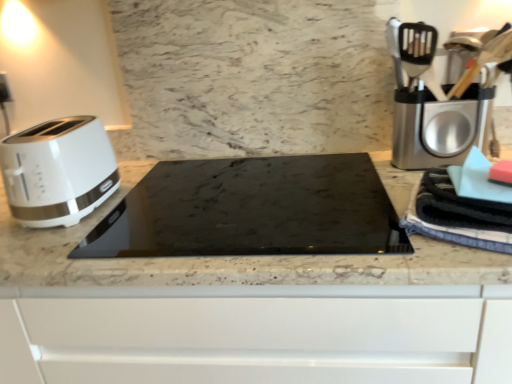
The image size is (512, 384). I want to click on vacant area that is situated to the right of white glossy toaster at left, so click(x=146, y=208).